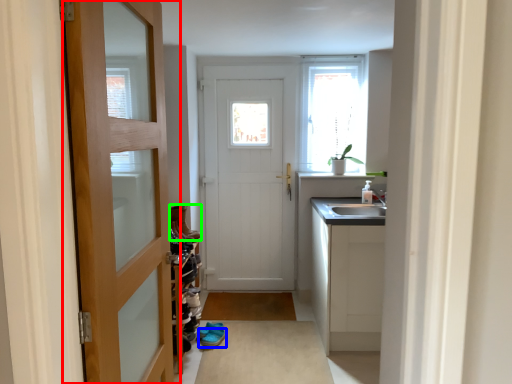
Question: Which object is the farthest from door (highlighted by a red box)? Choose among these: footwear (highlighted by a blue box) or shoe (highlighted by a green box).

Choices:
 (A) footwear
 (B) shoe

Answer: (A)